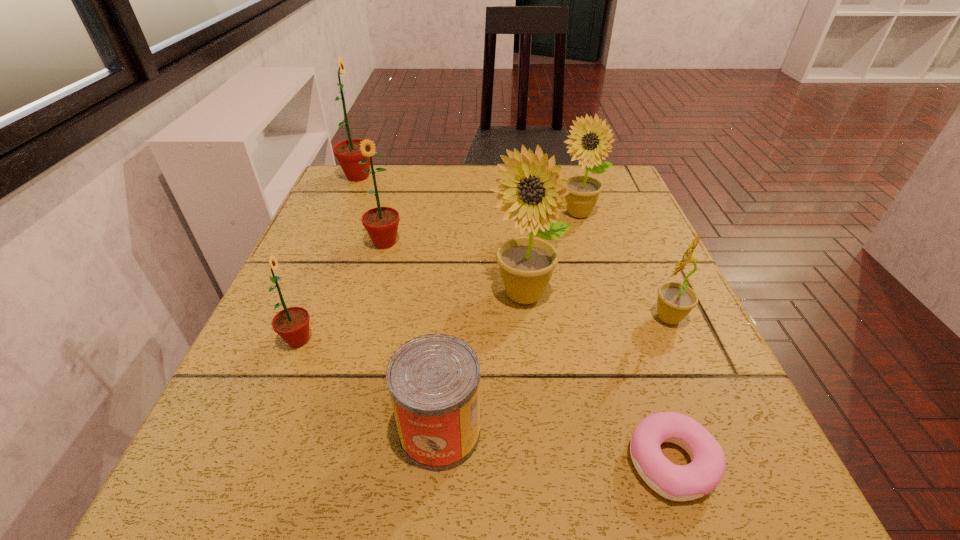
Locate an element on the screen. object situated at the near right corner is located at coordinates (674, 482).

Locate an element on the screen. free spot at the far edge of the desktop is located at coordinates (405, 202).

You are a GUI agent. You are given a task and a screenshot of the screen. Output one action in this format:
    pyautogui.click(x=<x>, y=<y>)
    Task: Click on the free space at the near edge
    This screenshot has width=960, height=540.
    Given the screenshot: What is the action you would take?
    pyautogui.click(x=330, y=508)

Find the location of a particular element. The width and height of the screenshot is (960, 540). vacant space at the left edge of the desktop is located at coordinates (252, 431).

At what (x,y) coordinates should I click in order to perform the action: click on vacant space at the right edge of the desktop. Please return your answer as a coordinate pair (x, y). This screenshot has width=960, height=540. Looking at the image, I should click on (672, 376).

You are a GUI agent. You are given a task and a screenshot of the screen. Output one action in this format:
    pyautogui.click(x=<x>, y=<y>)
    Task: Click on the free space at the near left corner
    The width and height of the screenshot is (960, 540).
    Given the screenshot: What is the action you would take?
    pyautogui.click(x=282, y=481)

Locate an element on the screen. free space at the far right corner of the desktop is located at coordinates (616, 165).

Identify the location of vacant area between the can and the biggest green sunflower. (399, 304).

The width and height of the screenshot is (960, 540). Identify the location of empty location between the fifth nearest sunflower and the smallest yellow sunflower. (623, 266).

The image size is (960, 540). In order to click on free point between the can and the farthest yellow sunflower in this screenshot , I will do `click(509, 323)`.